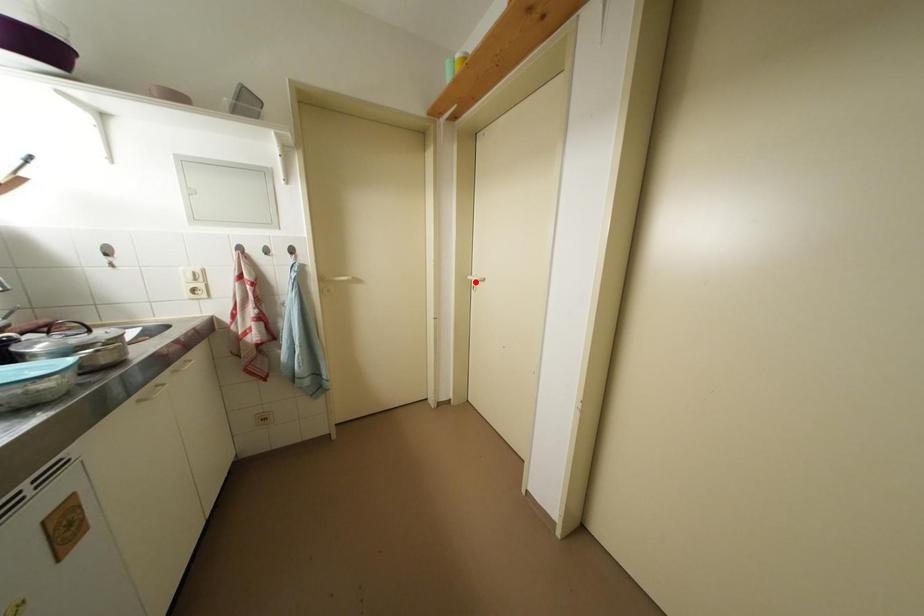
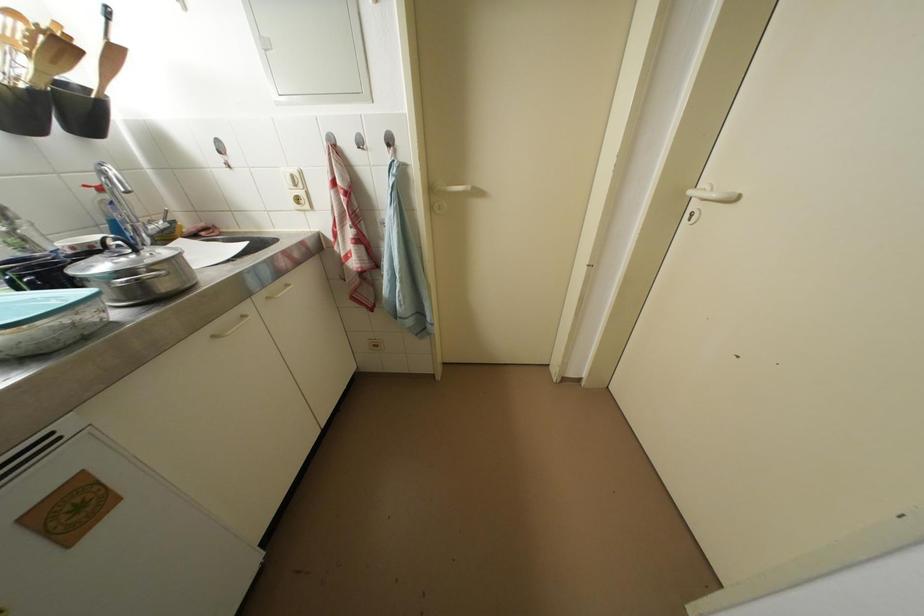
Question: I am providing you with two images of the same scene from different viewpoints. A red point is marked on the first image. At the location where the point appears in image 1, is it still visible in image 2?

Choices:
 (A) Yes
 (B) No

Answer: (A)